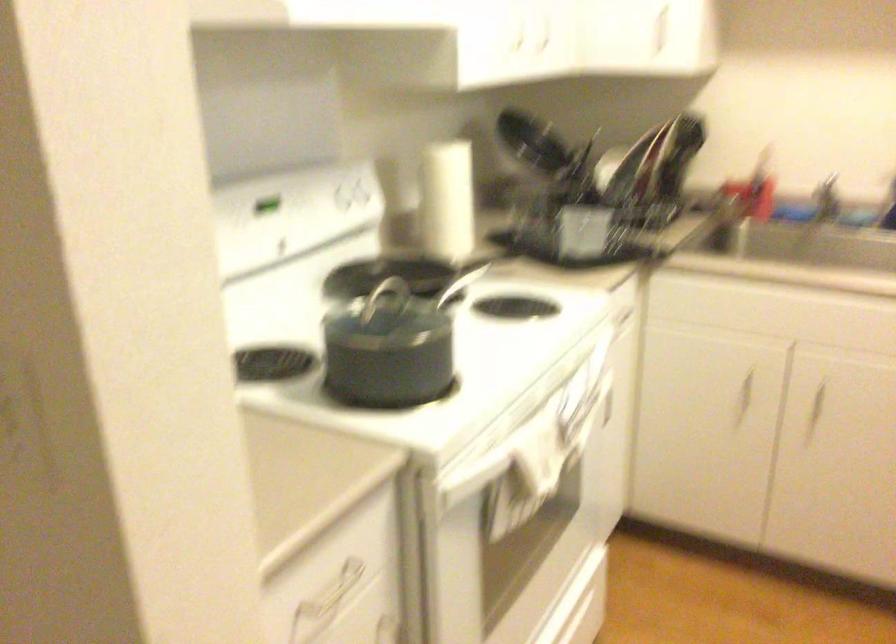
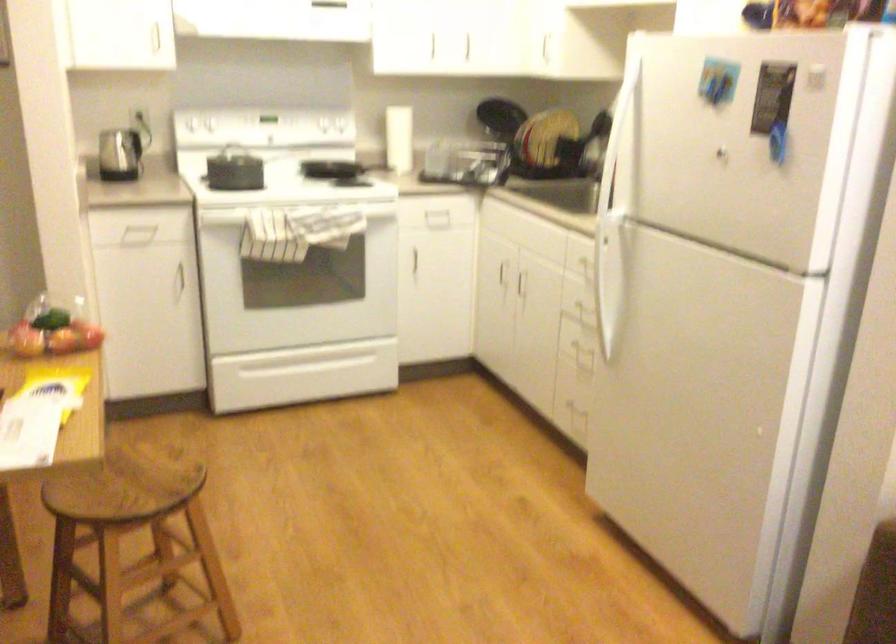
Where in the second image is the point corresponding to pixel 614 424 from the first image?

(435, 276)